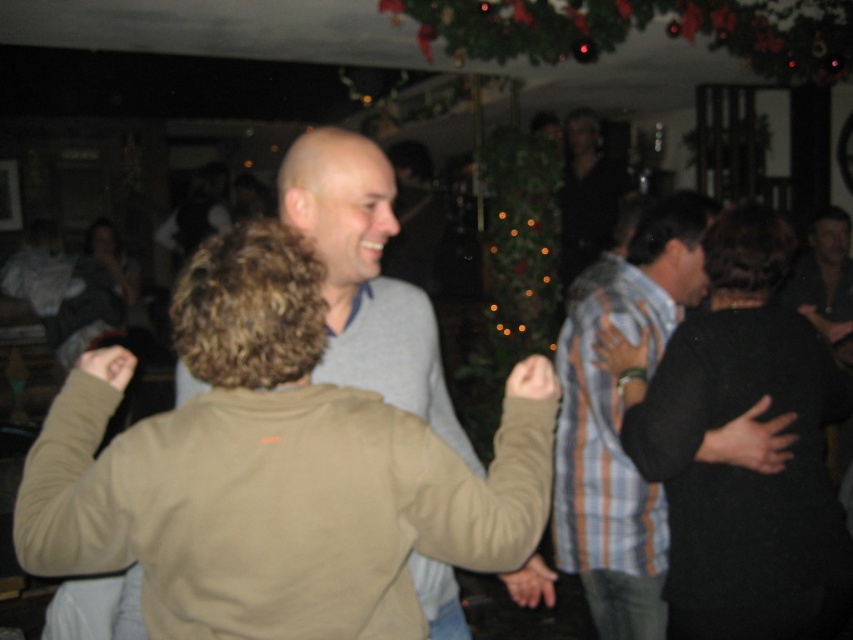
Question: Can you confirm if black matte dress at center is positioned to the right of striped cotton shirt at right?

Choices:
 (A) yes
 (B) no

Answer: (A)

Question: From the image, what is the correct spatial relationship of black matte dress at center in relation to dark gray shirt at right?

Choices:
 (A) left
 (B) right

Answer: (A)

Question: Based on their relative distances, which object is farther from the black matte dress at center?

Choices:
 (A) striped cotton shirt at right
 (B) dark gray shirt at right

Answer: (B)

Question: Is black matte dress at center bigger than gray matte sweater at center?

Choices:
 (A) yes
 (B) no

Answer: (B)

Question: Based on their relative distances, which object is farther from the striped cotton shirt at right?

Choices:
 (A) gray matte sweater at center
 (B) dark gray shirt at right

Answer: (B)

Question: Which point is closer to the camera taking this photo?

Choices:
 (A) (566, 461)
 (B) (846, 276)

Answer: (A)